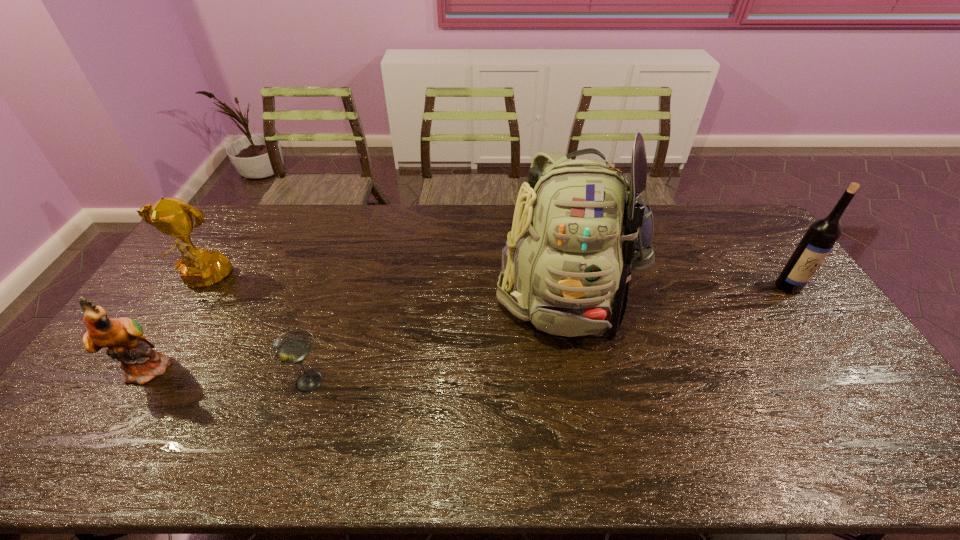
Where is `vacant position at the right edge of the desktop`? The height and width of the screenshot is (540, 960). vacant position at the right edge of the desktop is located at coordinates (756, 265).

Identify the location of free space between the parrot and the backpack. (357, 329).

You are a GUI agent. You are given a task and a screenshot of the screen. Output one action in this format:
    pyautogui.click(x=<x>, y=<y>)
    Task: Click on the vacant area that lies between the tallest object and the award
    This screenshot has width=960, height=540.
    Given the screenshot: What is the action you would take?
    pyautogui.click(x=383, y=286)

Locate an element on the screen. This screenshot has width=960, height=540. free space between the backpack and the parrot is located at coordinates (357, 329).

I want to click on vacant space that is in between the wine bottle and the tallest object, so click(676, 288).

Where is `unoccupied area between the parrot and the award`? This screenshot has height=540, width=960. unoccupied area between the parrot and the award is located at coordinates (177, 325).

Where is `vacant space in between the parrot and the third object from left to right`? The height and width of the screenshot is (540, 960). vacant space in between the parrot and the third object from left to right is located at coordinates (229, 374).

This screenshot has width=960, height=540. Find the location of `free spot between the rightmost object and the award`. free spot between the rightmost object and the award is located at coordinates (495, 284).

Find the location of `free space that is in between the wine bottle and the award`. free space that is in between the wine bottle and the award is located at coordinates (495, 284).

The width and height of the screenshot is (960, 540). I want to click on empty space that is in between the wine bottle and the parrot, so click(469, 327).